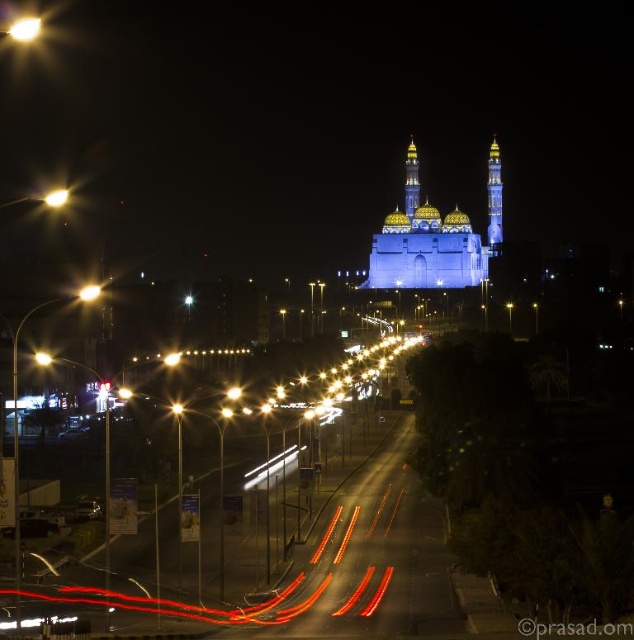
You are driving a car that is 5 meters long. You want to park your car between the metallic streetlight at upper left and the matte glass traffic light at left. Is there enough space between them to park your car?

The distance between the metallic streetlight at upper left and the matte glass traffic light at left is 55.52 meters, so yes, there is enough space to park a car that is 5 meters long between them.

You are a delivery driver approaching the mosque at night. You need to decide whether to turn left onto the road. To do this, you must determine if the metallic streetlight at upper left is taller than the matte glass traffic light at left. Can you confirm this?

The metallic streetlight at upper left is much taller than the matte glass traffic light at left, so yes, the metallic streetlight at upper left is taller.

Consider the image. You are a photographer planning to capture the mosque at night. You notice the blue glass minaret at upper center and the shiny gold tower at center. Which of these two structures would appear bigger in your photo?

The blue glass minaret at upper center is larger in size than the shiny gold tower at center, so it would appear bigger in the photo.